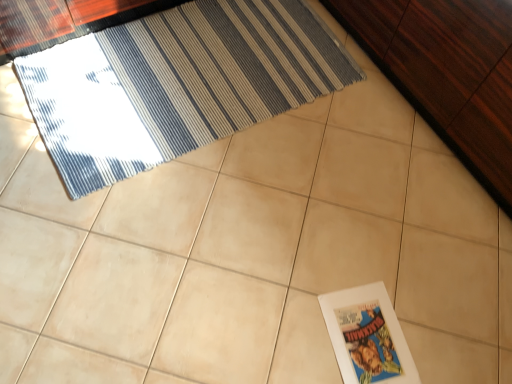
Locate an element on the screen. The image size is (512, 384). vacant space that's between blue striped rug at upper left and white paper at lower right is located at coordinates (252, 220).